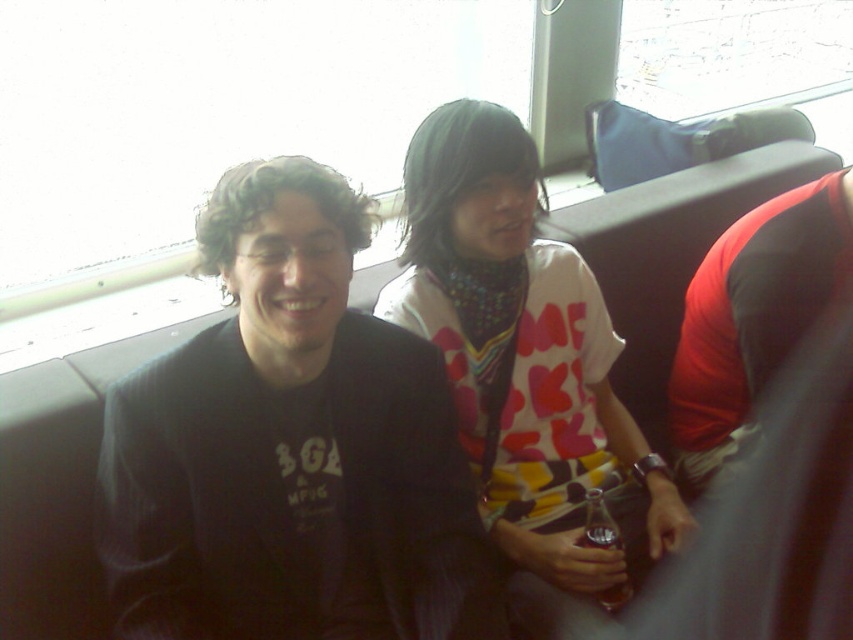
This screenshot has height=640, width=853. In order to click on dark gray sweater at center in this screenshot , I will do `click(289, 448)`.

Does dark gray sweater at center have a greater width compared to printed cotton shirt at center?

Indeed, dark gray sweater at center has a greater width compared to printed cotton shirt at center.

The height and width of the screenshot is (640, 853). Find the location of `dark gray sweater at center`. dark gray sweater at center is located at coordinates (289, 448).